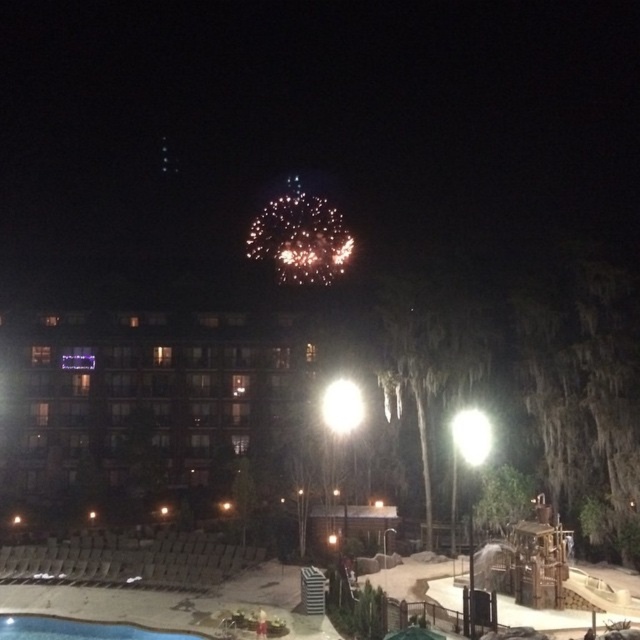
You are standing at the edge of the blue smooth pool at lower left and want to walk directly towards the matte glass hotel at center. Which direction should you head?

You should head to the right because the matte glass hotel at center is to the left of blue smooth pool at lower left, so moving right from the pool will lead you towards the hotel.

You are a photographer standing in the pool area and want to capture both the matte glass hotel at center and the blue smooth pool at lower left in a single wide shot. Based on their sizes, which object will appear bigger in the photo?

The matte glass hotel at center will appear bigger in the photo because it is larger in size than the blue smooth pool at lower left.